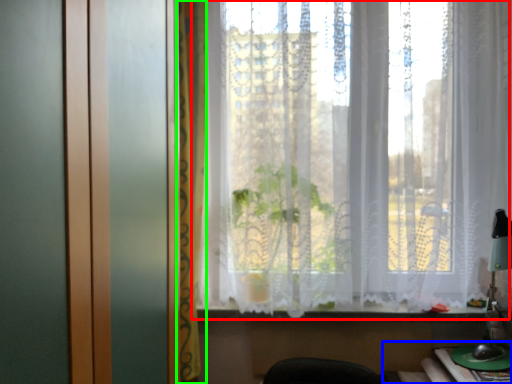
Question: Considering the real-world distances, which object is closest to curtain (highlighted by a red box)? table (highlighted by a blue box) or curtain (highlighted by a green box).

Choices:
 (A) table
 (B) curtain

Answer: (B)